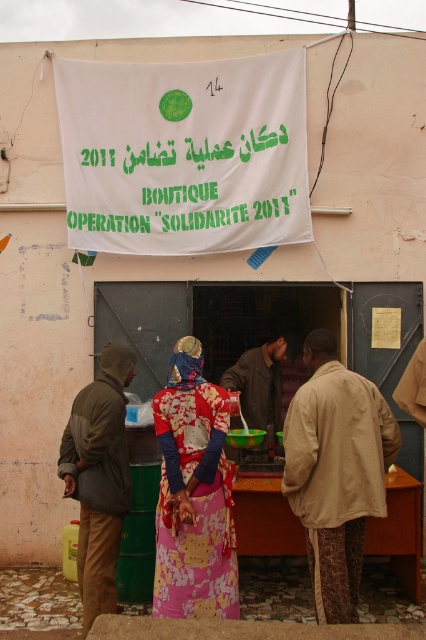
Does beige fabric jacket at center appear under printed fabric dress at center?

Incorrect, beige fabric jacket at center is not positioned below printed fabric dress at center.

Who is more distant from viewer, (322, 531) or (198, 388)?

Point (198, 388)

The image size is (426, 640). I want to click on beige fabric jacket at center, so click(336, 472).

Identify the location of beige fabric jacket at center. Image resolution: width=426 pixels, height=640 pixels. (336, 472).

Does printed fabric dress at center have a lesser height compared to dark green hooded jacket at left?

Indeed, printed fabric dress at center has a lesser height compared to dark green hooded jacket at left.

In the scene shown: Is printed fabric dress at center to the right of dark green hooded jacket at left from the viewer's perspective?

Yes, printed fabric dress at center is to the right of dark green hooded jacket at left.

You are a GUI agent. You are given a task and a screenshot of the screen. Output one action in this format:
    pyautogui.click(x=<x>, y=<y>)
    Task: Click on the printed fabric dress at center
    This screenshot has width=426, height=640.
    Given the screenshot: What is the action you would take?
    (193, 493)

Which is more to the left, beige fabric jacket at center or dark green hooded jacket at left?

dark green hooded jacket at left is more to the left.

Is the position of beige fabric jacket at center less distant than that of dark green hooded jacket at left?

Yes.

Where is `beige fabric jacket at center`? beige fabric jacket at center is located at coordinates (336, 472).